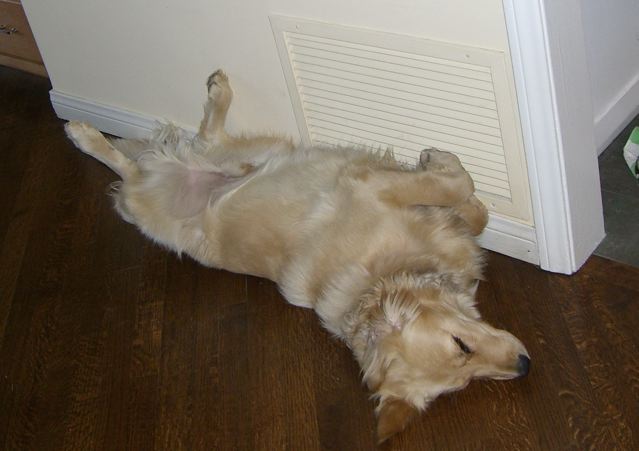
The height and width of the screenshot is (451, 639). I want to click on drawer handle, so click(x=10, y=27).